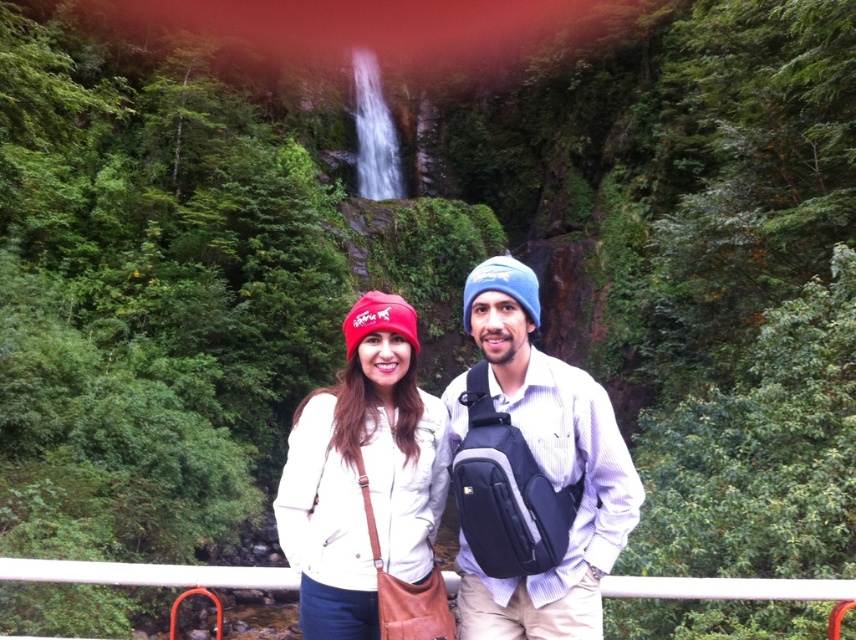
Is blue fabric beanie at center thinner than matte red beanie at center?

In fact, blue fabric beanie at center might be wider than matte red beanie at center.

In the scene shown: Can you confirm if blue fabric beanie at center is smaller than matte red beanie at center?

No, blue fabric beanie at center is not smaller than matte red beanie at center.

From the picture: Who is more distant from viewer, (477, 451) or (302, 620)?

Point (302, 620)

Where is `blue fabric beanie at center`? The height and width of the screenshot is (640, 856). blue fabric beanie at center is located at coordinates (532, 474).